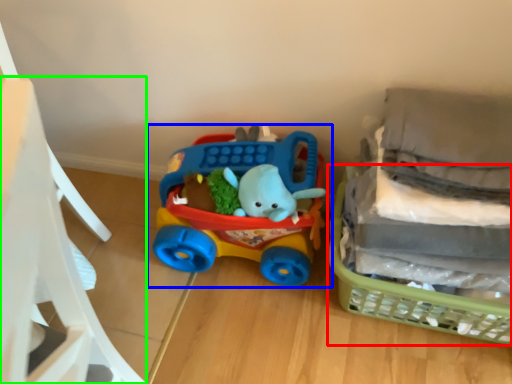
Question: Which object is the closest to the basket (highlighted by a red box)? Choose among these: toy (highlighted by a blue box) or chair (highlighted by a green box).

Choices:
 (A) toy
 (B) chair

Answer: (A)